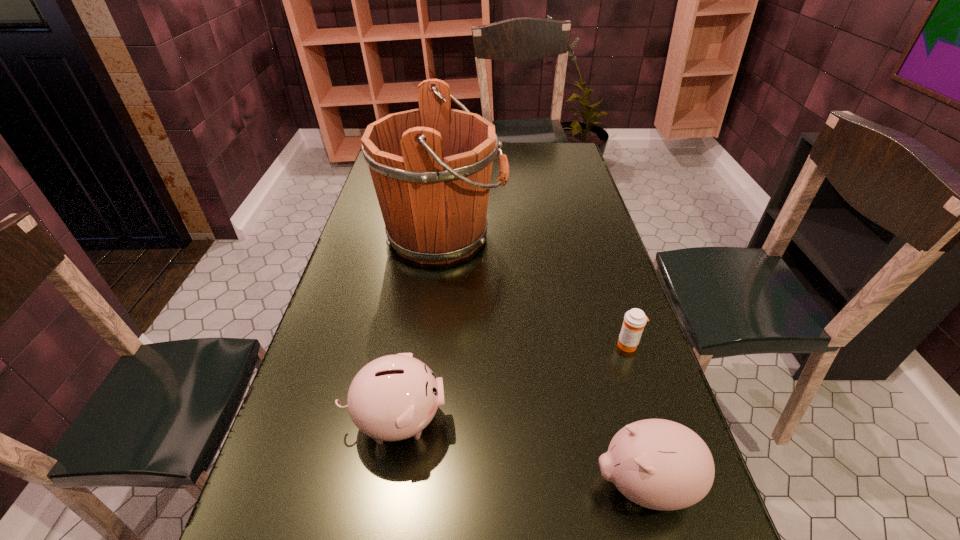
Identify which object is located as the third nearest to the shortest object. Please provide its 2D coordinates. Your answer should be formatted as a tuple, i.e. [(x, y)], where the tuple contains the x and y coordinates of a point satisfying the conditions above.

[(394, 397)]

At what (x,y) coordinates should I click in order to perform the action: click on free point that satisfies the following two spatial constraints: 1. with the handle on the side of the farthest object; 2. on the left side of the third nearest object. Please return your answer as a coordinate pair (x, y). Looking at the image, I should click on (431, 345).

Locate an element on the screen. This screenshot has width=960, height=540. blank space that satisfies the following two spatial constraints: 1. with the handle on the side of the second farthest object; 2. on the left side of the tallest object is located at coordinates (431, 345).

Locate an element on the screen. This screenshot has height=540, width=960. free spot that satisfies the following two spatial constraints: 1. with the handle on the side of the farthest object; 2. on the left side of the third nearest object is located at coordinates (431, 345).